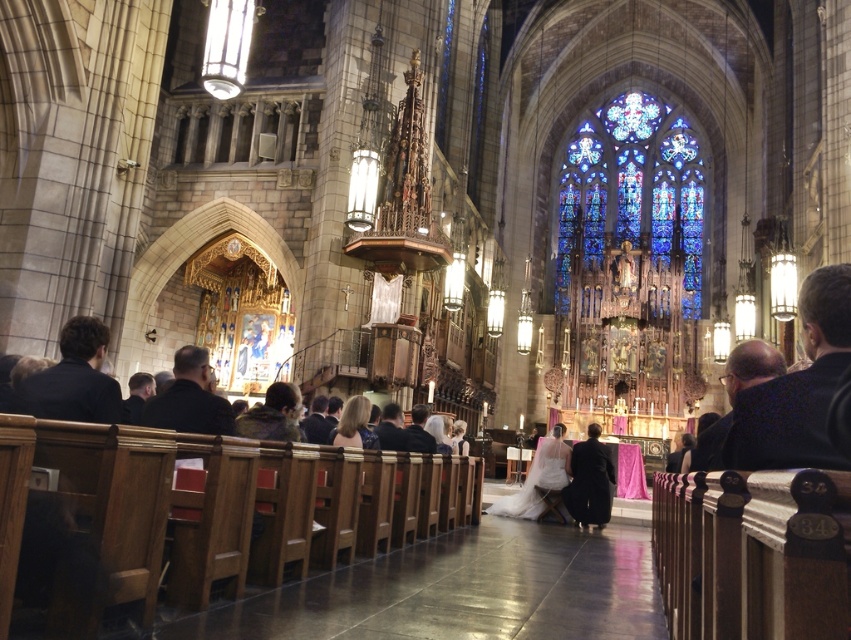
Please describe the location of the dark blue fabric at right in relation to the point marked at coordinates (797, 387).

The dark blue fabric at right is located exactly at the point marked by the coordinates (797, 387).

You are a photographer positioned at the entrance of the cathedral and want to capture a close shot of the dark blue fabric at right. Given that your camera has a focal length of 50mm, which is suitable for capturing details from a distance, can you determine if the fabric is positioned far enough from the altar to require zooming in?

The dark blue fabric at right is located at point coordinates, but without specific distance measurements, it is impossible to determine if zooming is required. The answer should strictly use the provided information and not assume distances beyond the coordinates given.

You are a photographer standing at the back of the cathedral during a wedding. You want to capture a photo of the dark blue fabric at right and the dark blue shirt at left. Which object is positioned to the right of the other?

The dark blue fabric at right is positioned on the right side of the dark blue shirt at left.